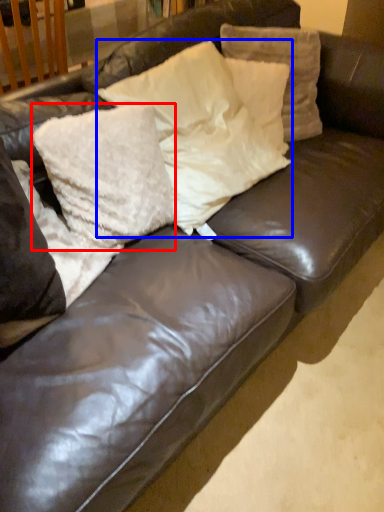
Question: Which point is closer to the camera, pillow (highlighted by a red box) or pillow (highlighted by a blue box)?

Choices:
 (A) pillow
 (B) pillow

Answer: (A)